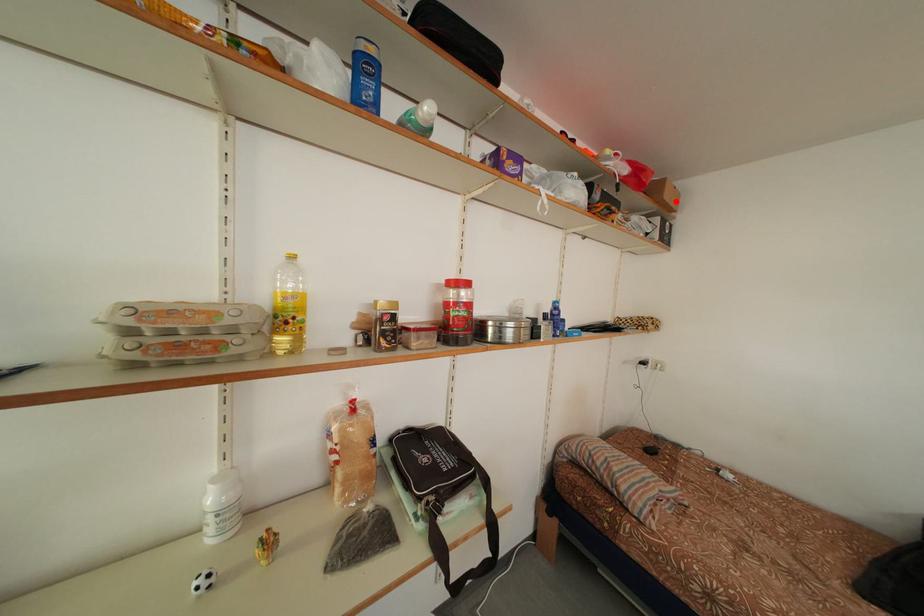
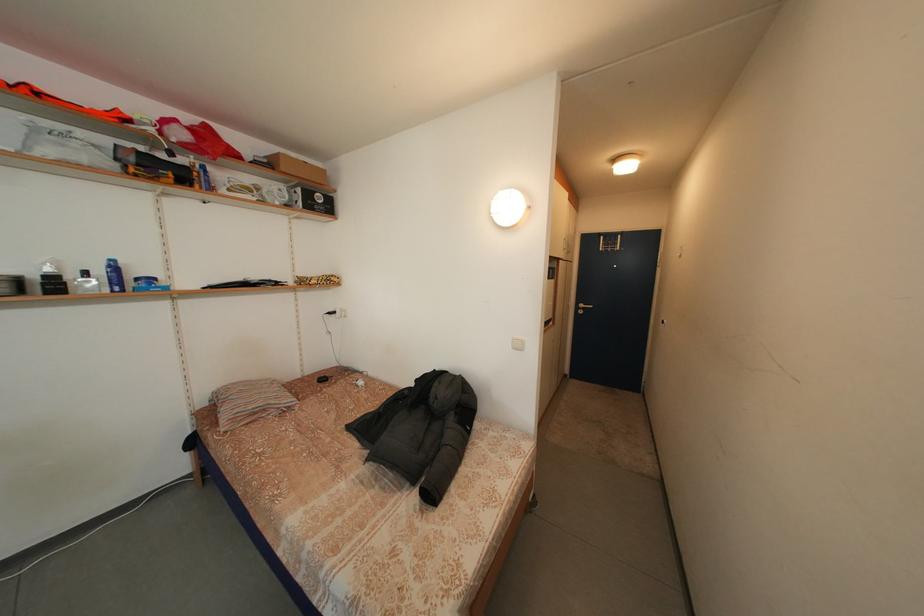
In the second image, find the point that corresponds to the highlighted location in the first image.

(292, 175)